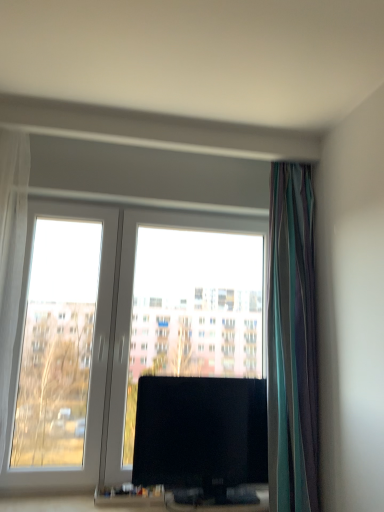
Measure the distance between point (174,300) and camera.

Point (174,300) is 2.44 meters from camera.

The width and height of the screenshot is (384, 512). In order to click on black glossy tv at center in this screenshot , I will do `click(201, 440)`.

Which object is more forward, transparent glass window at center or black glossy tv at center?

Positioned in front is black glossy tv at center.

Can you see transparent glass window at center touching black glossy tv at center?

transparent glass window at center and black glossy tv at center are not in contact.

From the picture: Does transparent glass window at center have a greater width compared to black glossy tv at center?

In fact, transparent glass window at center might be narrower than black glossy tv at center.

Who is taller, transparent glass window at center or black glossy tv at center?

transparent glass window at center.

Who is taller, black glossy tv at center or transparent glass window at center?

transparent glass window at center.

Considering the sizes of black glossy tv at center and transparent glass window at center in the image, is black glossy tv at center bigger or smaller than transparent glass window at center?

Clearly, black glossy tv at center is smaller in size than transparent glass window at center.

Is black glossy tv at center situated inside transparent glass window at center or outside?

black glossy tv at center is located beyond the bounds of transparent glass window at center.

Is point (222, 487) in front of point (124, 414)?

Yes, point (222, 487) is in front of point (124, 414).

Based on their positions, is transparent glass window at center located to the left or right of striped fabric curtain at right, the 1th curtain when ordered from right to left?

In the image, transparent glass window at center appears on the left side of striped fabric curtain at right, the 1th curtain when ordered from right to left.

Considering the positions of objects transparent glass window at center and striped fabric curtain at right, marked as the 2th curtain in a left-to-right arrangement, in the image provided, who is in front, transparent glass window at center or striped fabric curtain at right, marked as the 2th curtain in a left-to-right arrangement,?

striped fabric curtain at right, marked as the 2th curtain in a left-to-right arrangement, is in front.

Between point (154, 311) and point (274, 223), which one is positioned in front?

The point (274, 223) is closer to the camera.

Is transparent glass window at center inside the boundaries of striped fabric curtain at right, the 1th curtain when ordered from right to left, or outside?

transparent glass window at center is located beyond the bounds of striped fabric curtain at right, the 1th curtain when ordered from right to left.

Is striped fabric curtain at right, the 1th curtain when ordered from right to left, oriented away from transparent glass window at center?

No, striped fabric curtain at right, the 1th curtain when ordered from right to left, is not facing the opposite direction of transparent glass window at center.

Relative to transparent glass window at center, is striped fabric curtain at right, marked as the 2th curtain in a left-to-right arrangement, in front or behind?

Visually, striped fabric curtain at right, marked as the 2th curtain in a left-to-right arrangement, is located in front of transparent glass window at center.

Considering the relative sizes of striped fabric curtain at right, marked as the 2th curtain in a left-to-right arrangement, and transparent glass window at center in the image provided, is striped fabric curtain at right, marked as the 2th curtain in a left-to-right arrangement, thinner than transparent glass window at center?

Incorrect, the width of striped fabric curtain at right, marked as the 2th curtain in a left-to-right arrangement, is not less than that of transparent glass window at center.

How much distance is there between striped fabric curtain at right, marked as the 2th curtain in a left-to-right arrangement, and transparent glass window at center?

striped fabric curtain at right, marked as the 2th curtain in a left-to-right arrangement, and transparent glass window at center are 28.64 inches apart.

Locate an element on the screen. television on the left side of striped fabric curtain at right, marked as the 2th curtain in a left-to-right arrangement is located at coordinates (x=201, y=440).

From a real-world perspective, which object stands above the other?

striped fabric curtain at right, marked as the 2th curtain in a left-to-right arrangement, is physically above.

Based on their sizes in the image, would you say black glossy tv at center is bigger or smaller than striped fabric curtain at right, the 1th curtain when ordered from right to left?

Considering their sizes, black glossy tv at center takes up less space than striped fabric curtain at right, the 1th curtain when ordered from right to left.

Is black glossy tv at center placed right next to striped fabric curtain at right, the 1th curtain when ordered from right to left?

No, black glossy tv at center is not touching striped fabric curtain at right, the 1th curtain when ordered from right to left.

Are white sheer curtain at left, which is the 2th curtain from right to left, and transparent glass window at center located far from each other?

No, there isn't a large distance between white sheer curtain at left, which is the 2th curtain from right to left, and transparent glass window at center.

From a real-world perspective, is white sheer curtain at left, which is the 1th curtain in left-to-right order, on top of transparent glass window at center?

Yes, from a real-world perspective, white sheer curtain at left, which is the 1th curtain in left-to-right order, is over transparent glass window at center

How many degrees apart are the facing directions of white sheer curtain at left, which is the 1th curtain in left-to-right order, and transparent glass window at center?

6.97e-05 degrees separate the facing orientations of white sheer curtain at left, which is the 1th curtain in left-to-right order, and transparent glass window at center.

Between point (0, 293) and point (113, 360), which one is positioned in front?

Positioned in front is point (0, 293).

What's the angular difference between black glossy tv at center and white sheer curtain at left, which is the 1th curtain in left-to-right order,'s facing directions?

→ They differ by 3.71e-05 degrees in their facing directions.

Is black glossy tv at center not close to white sheer curtain at left, which is the 2th curtain from right to left?

No, there isn't a large distance between black glossy tv at center and white sheer curtain at left, which is the 2th curtain from right to left.

From the image's perspective, is black glossy tv at center positioned above or below white sheer curtain at left, which is the 2th curtain from right to left?

black glossy tv at center is situated lower than white sheer curtain at left, which is the 2th curtain from right to left, in the image.

Considering the relative sizes of black glossy tv at center and white sheer curtain at left, which is the 2th curtain from right to left, in the image provided, is black glossy tv at center smaller than white sheer curtain at left, which is the 2th curtain from right to left,?

Yes, black glossy tv at center is smaller than white sheer curtain at left, which is the 2th curtain from right to left.

Locate an element on the screen. television below the transparent glass window at center (from a real-world perspective) is located at coordinates (201, 440).

At what (x,y) coordinates should I click in order to perform the action: click on television in front of the transparent glass window at center. Please return your answer as a coordinate pair (x, y). Looking at the image, I should click on (201, 440).

Estimate the real-world distances between objects in this image. Which object is further from black glossy tv at center, transparent glass window at center or striped fabric curtain at right, the 1th curtain when ordered from right to left?

transparent glass window at center is positioned further to the anchor black glossy tv at center.

Based on their spatial positions, is white sheer curtain at left, which is the 1th curtain in left-to-right order, or striped fabric curtain at right, the 1th curtain when ordered from right to left, further from transparent glass window at center?

striped fabric curtain at right, the 1th curtain when ordered from right to left, is positioned further to the anchor transparent glass window at center.

Estimate the real-world distances between objects in this image. Which object is closer to striped fabric curtain at right, marked as the 2th curtain in a left-to-right arrangement, transparent glass window at center or white sheer curtain at left, which is the 2th curtain from right to left?

transparent glass window at center is positioned closer to the anchor striped fabric curtain at right, marked as the 2th curtain in a left-to-right arrangement.

Estimate the real-world distances between objects in this image. Which object is closer to transparent glass window at center, black glossy tv at center or white sheer curtain at left, which is the 2th curtain from right to left?

black glossy tv at center is closer to transparent glass window at center.

From the image, which object appears to be farther from black glossy tv at center, striped fabric curtain at right, marked as the 2th curtain in a left-to-right arrangement, or transparent glass window at center?

transparent glass window at center is positioned further to the anchor black glossy tv at center.

Based on the photo, when comparing their distances from white sheer curtain at left, which is the 1th curtain in left-to-right order, does striped fabric curtain at right, the 1th curtain when ordered from right to left, or transparent glass window at center seem further?

striped fabric curtain at right, the 1th curtain when ordered from right to left, lies further to white sheer curtain at left, which is the 1th curtain in left-to-right order, than the other object.

Which object lies nearer to the anchor point striped fabric curtain at right, the 1th curtain when ordered from right to left, white sheer curtain at left, which is the 2th curtain from right to left, or black glossy tv at center?

black glossy tv at center is positioned closer to the anchor striped fabric curtain at right, the 1th curtain when ordered from right to left.

When comparing their distances from striped fabric curtain at right, the 1th curtain when ordered from right to left, does black glossy tv at center or transparent glass window at center seem further?

transparent glass window at center lies further to striped fabric curtain at right, the 1th curtain when ordered from right to left, than the other object.

Locate an element on the screen. window between white sheer curtain at left, which is the 2th curtain from right to left, and striped fabric curtain at right, the 1th curtain when ordered from right to left, from left to right is located at coordinates (122, 330).

Where is `television situated between transparent glass window at center and striped fabric curtain at right, marked as the 2th curtain in a left-to-right arrangement, from left to right`? television situated between transparent glass window at center and striped fabric curtain at right, marked as the 2th curtain in a left-to-right arrangement, from left to right is located at coordinates (201, 440).

At what (x,y) coordinates should I click in order to perform the action: click on window between white sheer curtain at left, which is the 1th curtain in left-to-right order, and black glossy tv at center, in the horizontal direction. Please return your answer as a coordinate pair (x, y). The height and width of the screenshot is (512, 384). Looking at the image, I should click on (122, 330).

I want to click on television between white sheer curtain at left, which is the 2th curtain from right to left, and striped fabric curtain at right, marked as the 2th curtain in a left-to-right arrangement, in the horizontal direction, so click(x=201, y=440).